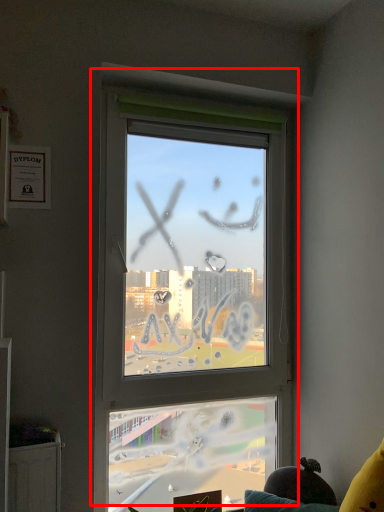
Question: From the image's perspective, where is window (annotated by the red box) located in relation to couch in the image?

Choices:
 (A) below
 (B) above

Answer: (B)